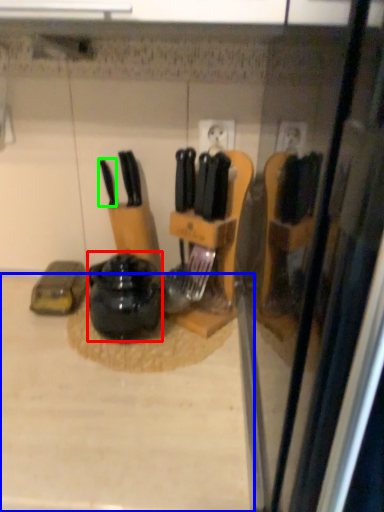
Question: Which object is positioned closest to kitchen appliance (highlighted by a red box)? Select from counter top (highlighted by a blue box) and knife (highlighted by a green box).

Choices:
 (A) counter top
 (B) knife

Answer: (A)